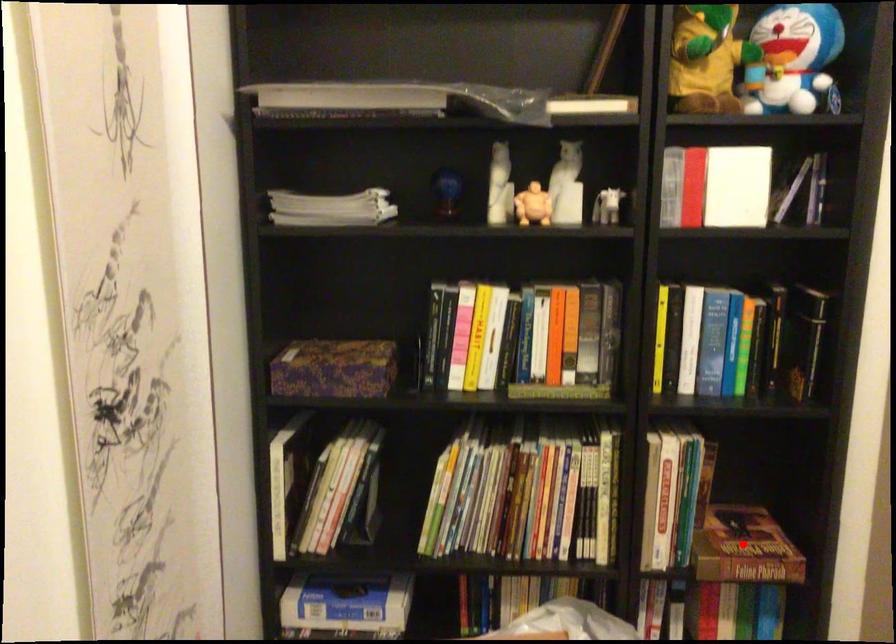
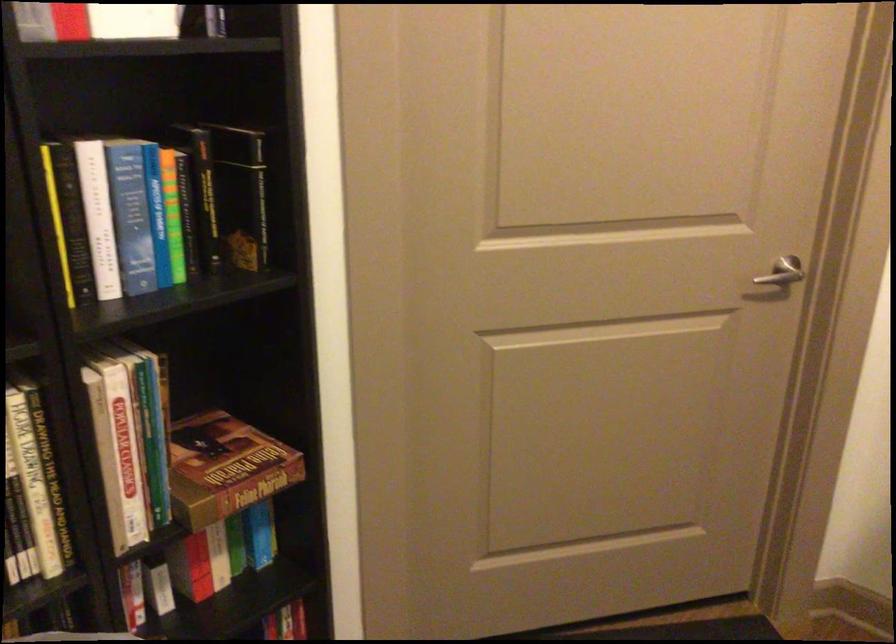
Locate, in the second image, the point that corresponds to the highlighted location in the first image.

(225, 468)